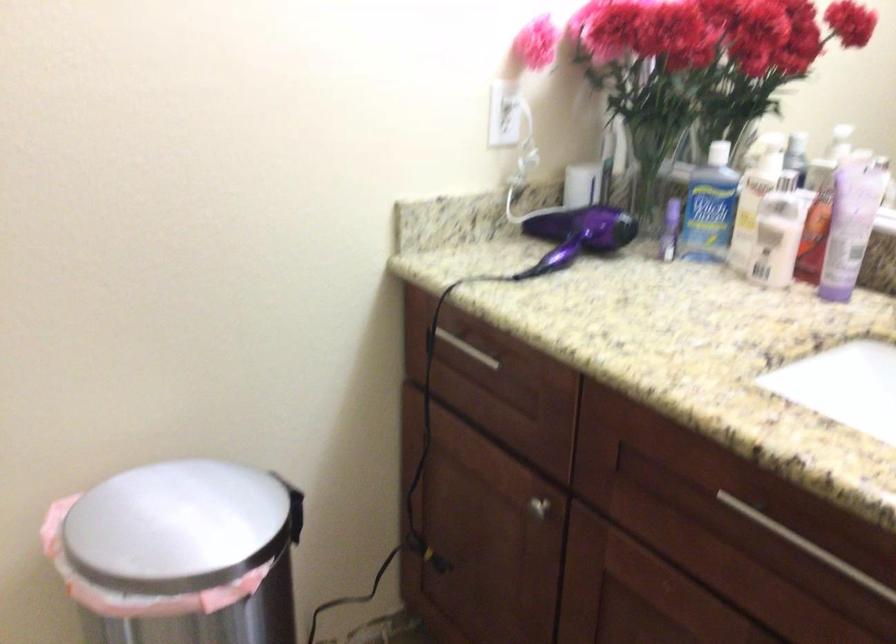
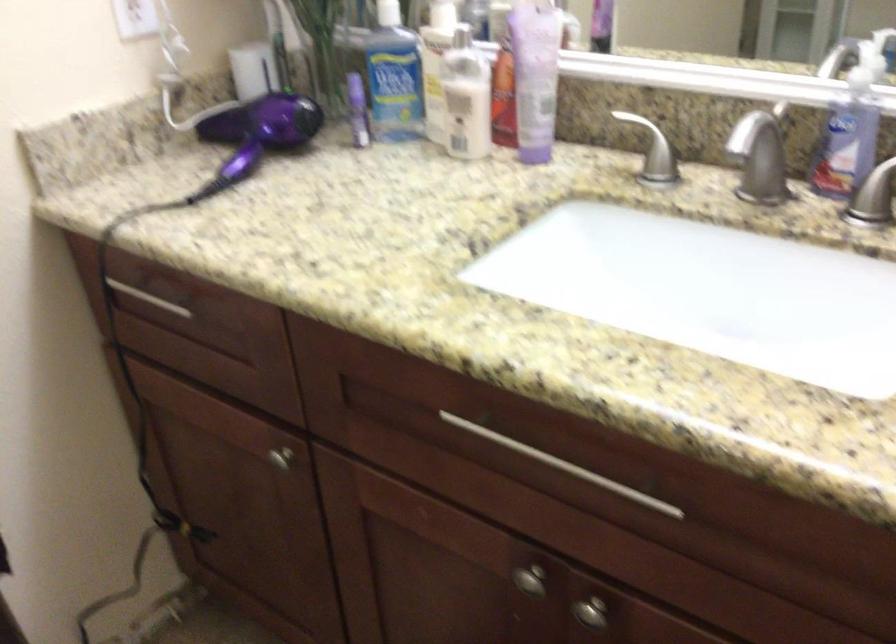
Question: I am providing you with two images of the same scene from different viewpoints. After the viewpoint changes to image2, which objects are now occluded?

Choices:
 (A) soap pump dispenser
 (B) blue plastic bottle
 (C) lotion pump dispenser
 (D) none of these

Answer: (D)